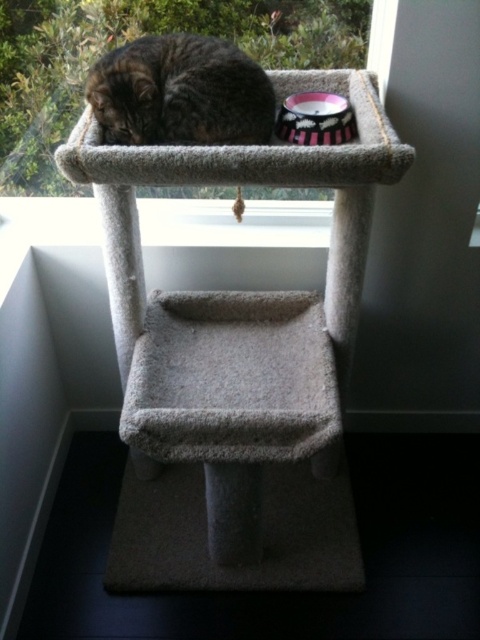
Does clear glass window at upper center appear over tabby fur cat at upper center?

Yes, clear glass window at upper center is above tabby fur cat at upper center.

Does clear glass window at upper center have a greater height compared to tabby fur cat at upper center?

Correct, clear glass window at upper center is much taller as tabby fur cat at upper center.

What are the coordinates of `clear glass window at upper center` in the screenshot? It's located at (134, 36).

This screenshot has width=480, height=640. I want to click on clear glass window at upper center, so click(134, 36).